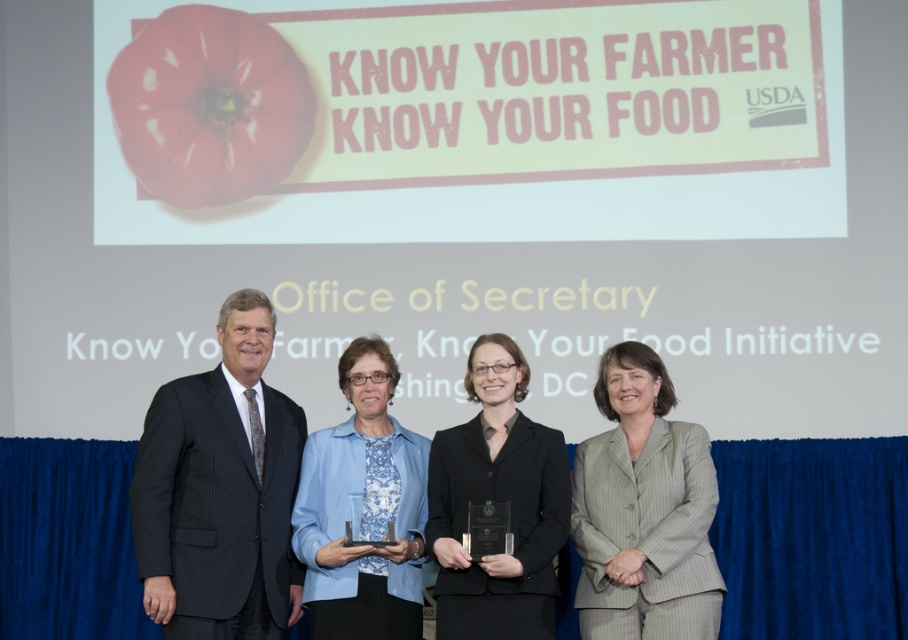
Question: Which object is positioned closest to the gray pinstripe suit at center?

Choices:
 (A) black pinstripe suit at left
 (B) matte red tomato at upper left
 (C) blue printed blouse at center
 (D) black glossy suit at center

Answer: (D)

Question: Does gray pinstripe suit at center appear on the left side of blue printed blouse at center?

Choices:
 (A) no
 (B) yes

Answer: (A)

Question: Which point appears farthest from the camera in this image?

Choices:
 (A) (506, 582)
 (B) (372, 612)

Answer: (B)

Question: Which object appears closest to the camera in this image?

Choices:
 (A) black glossy suit at center
 (B) gray pinstripe suit at center
 (C) matte red tomato at upper left

Answer: (B)

Question: Can you confirm if matte red tomato at upper left is wider than blue printed blouse at center?

Choices:
 (A) no
 (B) yes

Answer: (B)

Question: Can you confirm if matte red tomato at upper left is wider than blue printed blouse at center?

Choices:
 (A) no
 (B) yes

Answer: (B)